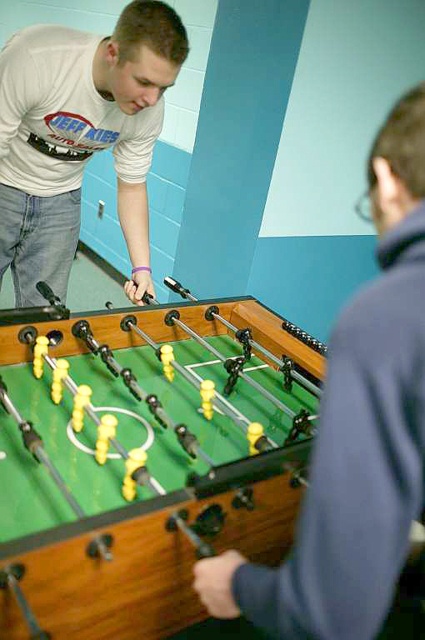
In the scene shown: What is the exact coordinate of the green wooden foosball table at center?

The green wooden foosball table at center is located at point (141,461).